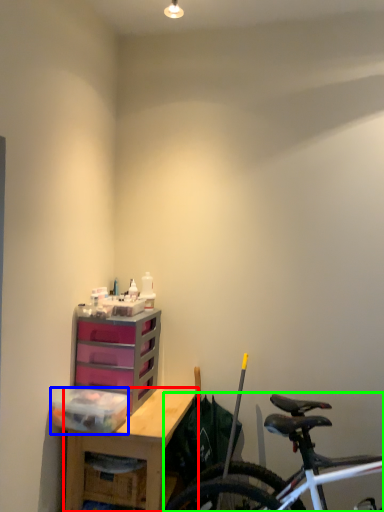
Question: Which object is positioned closest to desk (highlighted by a red box)? Select from storage box (highlighted by a blue box) and bicycle (highlighted by a green box).

Choices:
 (A) storage box
 (B) bicycle

Answer: (A)